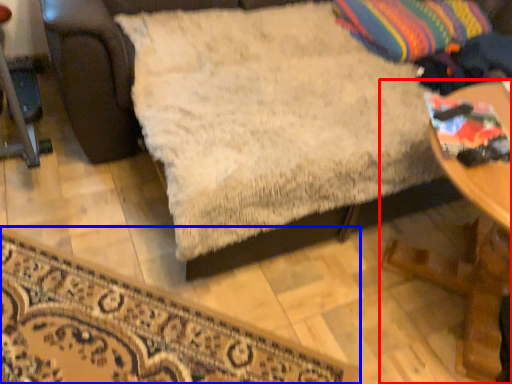
Question: Among these objects, which one is farthest to the camera, table (highlighted by a red box) or furniture (highlighted by a blue box)?

Choices:
 (A) table
 (B) furniture

Answer: (B)